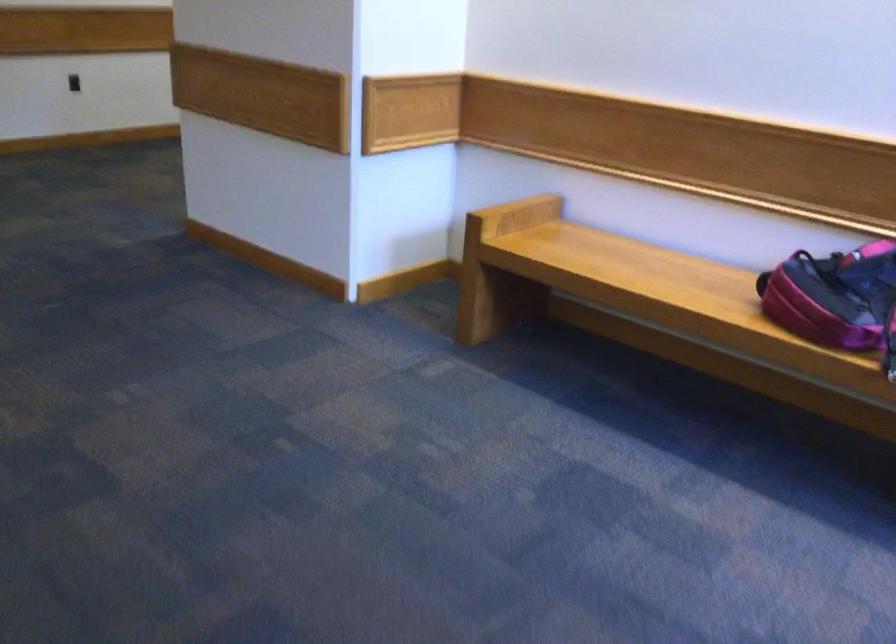
The image size is (896, 644). Find the location of `red and black backpack`. red and black backpack is located at coordinates (833, 296).